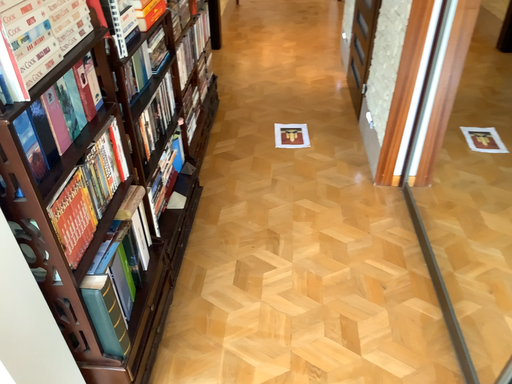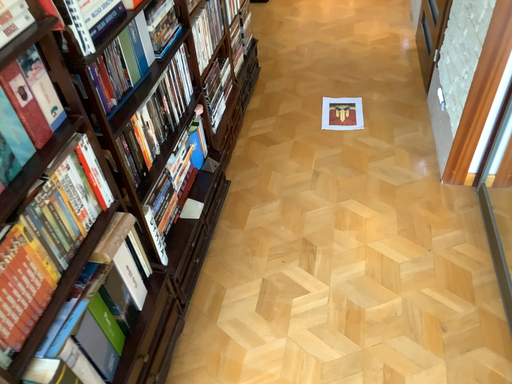
Question: Which way did the camera rotate in the video?

Choices:
 (A) rotated downward
 (B) rotated upward

Answer: (A)